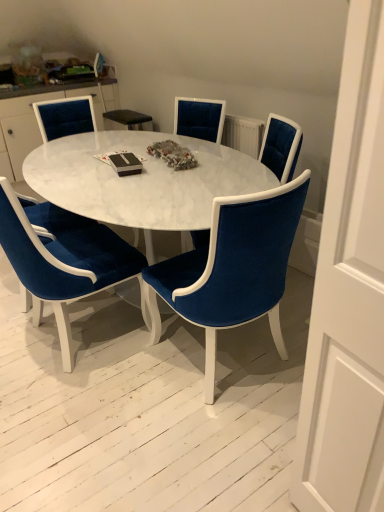
At what (x,y) coordinates should I click in order to perform the action: click on free space above white marble coffee table at center (from a real-world perspective). Please return your answer as a coordinate pair (x, y). Looking at the image, I should click on (131, 160).